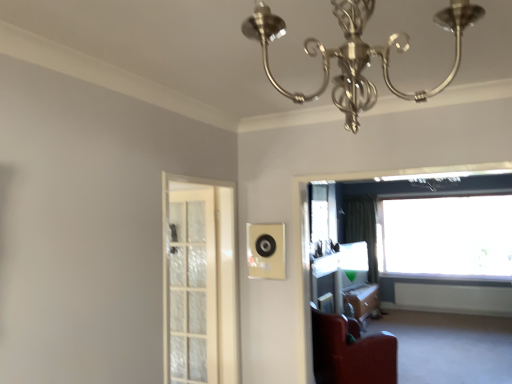
Question: Looking at the image, does clear plastic window screen at right seem bigger or smaller compared to transparent glass window at upper right, which is counted as the first window, starting from the front?

Choices:
 (A) small
 (B) big

Answer: (A)

Question: From the image's perspective, is clear plastic window screen at right above or below transparent glass window at upper right, which is counted as the first window, starting from the front?

Choices:
 (A) below
 (B) above

Answer: (B)

Question: Based on their relative distances, which object is farther from the clear plastic window screen at right?

Choices:
 (A) green fabric curtain at right
 (B) white frosted glass screen door at left
 (C) transparent glass window at upper right, marked as the 2th window in a right-to-left arrangement
 (D) wooden table at lower right
 (E) polished silver chandelier at upper center

Answer: (E)

Question: Based on their relative distances, which object is nearer to the polished silver chandelier at upper center?

Choices:
 (A) clear plastic window screen at right
 (B) velvet red armchair at lower right
 (C) white frosted glass screen door at left
 (D) green fabric curtain at right
 (E) matte black speaker at center

Answer: (E)